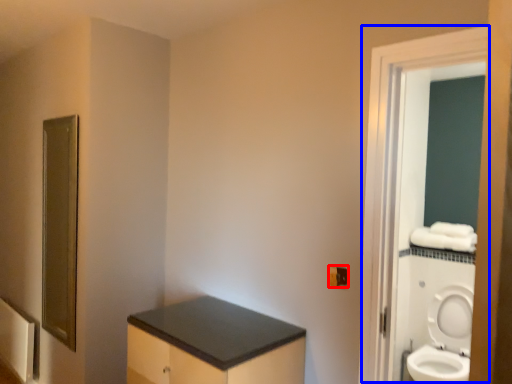
Question: Among these objects, which one is nearest to the camera, electric outlet (highlighted by a red box) or screen door (highlighted by a blue box)?

Choices:
 (A) electric outlet
 (B) screen door

Answer: (B)